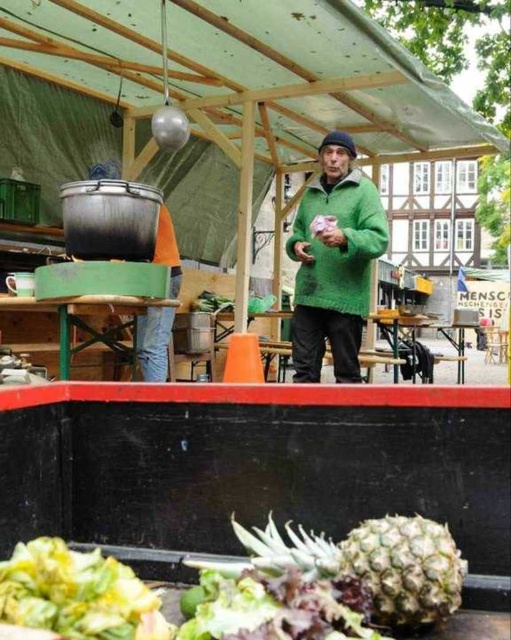
You are a customer at the market and want to buy a pineapple. The pineapple is located at the point marked as point (128, 605). If you are standing 1 meter away from this point, can you comfortably reach the pineapple without moving closer?

The distance between the viewer and point (128, 605) is 95.69 centimeters. Since you are standing 1 meter away, which is slightly farther than the given distance, you might need to step closer to comfortably reach the pineapple.

You are a customer at the market and want to know which point is nearer to you. The points are labeled as point 1 at coordinates point (433, 545) and point 2 at coordinates point (158, 328). Which point is closer to you?

Point (433, 545) is closer to the viewer than point (158, 328).

You are a customer at the market and want to reach the items on the counter. You notice two points on the counter marked as point [338,326] and point [138,616]. Which point is closer to you?

Point [338,326] is further to the viewer than point [138,616], so the point closer to you is point [138,616].